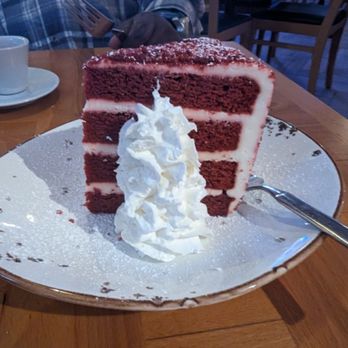
Image resolution: width=348 pixels, height=348 pixels. In order to click on mug in this screenshot , I will do `click(13, 64)`.